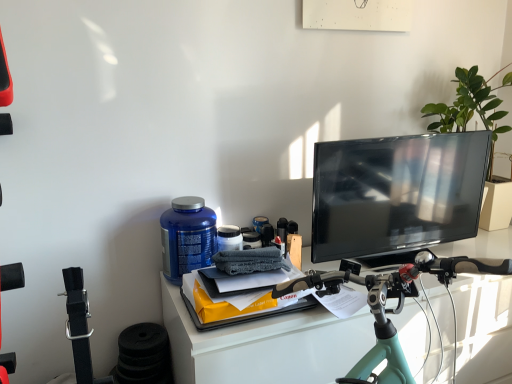
Question: From the image's perspective, does blue plastic bottle at center-left appear higher than teal matte bicycle handlebars at center?

Choices:
 (A) no
 (B) yes

Answer: (B)

Question: Can you confirm if blue plastic bottle at center-left is wider than teal matte bicycle handlebars at center?

Choices:
 (A) no
 (B) yes

Answer: (A)

Question: Does blue plastic bottle at center-left have a smaller size compared to teal matte bicycle handlebars at center?

Choices:
 (A) yes
 (B) no

Answer: (A)

Question: Can you confirm if blue plastic bottle at center-left is taller than teal matte bicycle handlebars at center?

Choices:
 (A) no
 (B) yes

Answer: (A)

Question: Is blue plastic bottle at center-left positioned with its back to teal matte bicycle handlebars at center?

Choices:
 (A) no
 (B) yes

Answer: (A)

Question: Does blue plastic bottle at center-left have a larger size compared to teal matte bicycle handlebars at center?

Choices:
 (A) no
 (B) yes

Answer: (A)

Question: Would you say teal matte bicycle handlebars at center contains green leafy plant at upper right?

Choices:
 (A) yes
 (B) no

Answer: (B)

Question: From a real-world perspective, is teal matte bicycle handlebars at center positioned under green leafy plant at upper right based on gravity?

Choices:
 (A) no
 (B) yes

Answer: (B)

Question: From the image's perspective, does teal matte bicycle handlebars at center appear lower than green leafy plant at upper right?

Choices:
 (A) no
 (B) yes

Answer: (B)

Question: Does teal matte bicycle handlebars at center appear on the left side of green leafy plant at upper right?

Choices:
 (A) no
 (B) yes

Answer: (B)

Question: Is teal matte bicycle handlebars at center positioned in front of green leafy plant at upper right?

Choices:
 (A) yes
 (B) no

Answer: (A)

Question: From a real-world perspective, is teal matte bicycle handlebars at center on green leafy plant at upper right?

Choices:
 (A) yes
 (B) no

Answer: (B)

Question: From a real-world perspective, is teal matte bicycle handlebars at center under blue plastic bottle at center-left?

Choices:
 (A) yes
 (B) no

Answer: (A)